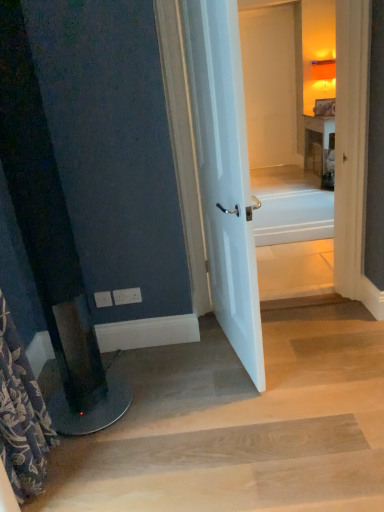
This screenshot has height=512, width=384. In order to click on white plastic electric outlet at lower left, the second electric outlet in the right-to-left sequence in this screenshot , I will do `click(103, 298)`.

Measure the distance between light brown wood at lower center and camera.

The depth of light brown wood at lower center is 1.38 meters.

The height and width of the screenshot is (512, 384). What do you see at coordinates (224, 173) in the screenshot?
I see `white glossy door at center` at bounding box center [224, 173].

This screenshot has width=384, height=512. Describe the element at coordinates (127, 296) in the screenshot. I see `white plastic electric outlet at lower left, acting as the first electric outlet starting from the right` at that location.

Find the location of `white plastic electric outlet at lower left, placed as the first electric outlet when sorted from left to right`. white plastic electric outlet at lower left, placed as the first electric outlet when sorted from left to right is located at coordinates (103, 298).

From the picture: Does floral fabric shower curtain at left have a lesser height compared to white glossy door at center?

Yes.

Would you say floral fabric shower curtain at left is inside or outside white glossy door at center?

floral fabric shower curtain at left is not inside white glossy door at center, it's outside.

What are the coordinates of `shower curtain below the white glossy door at center (from the image's perspective)` in the screenshot? It's located at (21, 415).

Which of these two, white plastic electric outlet at lower left, the second electric outlet in the right-to-left sequence, or white plastic electric outlet at lower left, which ranks as the 2th electric outlet in left-to-right order, is smaller?

white plastic electric outlet at lower left, the second electric outlet in the right-to-left sequence, is smaller.

Is white plastic electric outlet at lower left, placed as the first electric outlet when sorted from left to right, inside or outside of white plastic electric outlet at lower left, acting as the first electric outlet starting from the right?

white plastic electric outlet at lower left, placed as the first electric outlet when sorted from left to right, exists outside the volume of white plastic electric outlet at lower left, acting as the first electric outlet starting from the right.

Is point (103, 294) farther from viewer compared to point (131, 296)?

Yes, point (103, 294) is farther from viewer.

From the image's perspective, which is below, white glossy door at center or white plastic electric outlet at lower left, the second electric outlet in the right-to-left sequence?

white plastic electric outlet at lower left, the second electric outlet in the right-to-left sequence, from the image's perspective.

Can you confirm if white glossy door at center is wider than white plastic electric outlet at lower left, placed as the first electric outlet when sorted from left to right?

Yes, white glossy door at center is wider than white plastic electric outlet at lower left, placed as the first electric outlet when sorted from left to right.

Considering the positions of objects white glossy door at center and white plastic electric outlet at lower left, placed as the first electric outlet when sorted from left to right, in the image provided, who is behind, white glossy door at center or white plastic electric outlet at lower left, placed as the first electric outlet when sorted from left to right,?

Positioned behind is white plastic electric outlet at lower left, placed as the first electric outlet when sorted from left to right.

From a real-world perspective, which is physically below, floral fabric shower curtain at left or white plastic electric outlet at lower left, which ranks as the 2th electric outlet in left-to-right order?

white plastic electric outlet at lower left, which ranks as the 2th electric outlet in left-to-right order, from a real-world perspective.

Is floral fabric shower curtain at left far away from white plastic electric outlet at lower left, which ranks as the 2th electric outlet in left-to-right order?

floral fabric shower curtain at left is actually quite close to white plastic electric outlet at lower left, which ranks as the 2th electric outlet in left-to-right order.

Between floral fabric shower curtain at left and white plastic electric outlet at lower left, acting as the first electric outlet starting from the right, which one has smaller size?

Smaller between the two is white plastic electric outlet at lower left, acting as the first electric outlet starting from the right.

Which of these two, floral fabric shower curtain at left or white plastic electric outlet at lower left, which ranks as the 2th electric outlet in left-to-right order, stands taller?

floral fabric shower curtain at left.

Does white glossy bathtub at center turn towards white plastic electric outlet at lower left, acting as the first electric outlet starting from the right?

No, white glossy bathtub at center does not turn towards white plastic electric outlet at lower left, acting as the first electric outlet starting from the right.

In terms of size, does white glossy bathtub at center appear bigger or smaller than white plastic electric outlet at lower left, which ranks as the 2th electric outlet in left-to-right order?

Considering their sizes, white glossy bathtub at center takes up more space than white plastic electric outlet at lower left, which ranks as the 2th electric outlet in left-to-right order.

Relative to white plastic electric outlet at lower left, which ranks as the 2th electric outlet in left-to-right order, is white glossy bathtub at center in front or behind?

Visually, white glossy bathtub at center is located behind white plastic electric outlet at lower left, which ranks as the 2th electric outlet in left-to-right order.

Looking at their sizes, would you say white glossy bathtub at center is wider or thinner than white plastic electric outlet at lower left, acting as the first electric outlet starting from the right?

Considering their sizes, white glossy bathtub at center looks broader than white plastic electric outlet at lower left, acting as the first electric outlet starting from the right.

What's the angular difference between white glossy bathtub at center and floral fabric shower curtain at left's facing directions?

The angle between the facing direction of white glossy bathtub at center and the facing direction of floral fabric shower curtain at left is 90.2 degrees.

From a real-world perspective, is white glossy bathtub at center over floral fabric shower curtain at left?

No, from a real-world perspective, white glossy bathtub at center is not over floral fabric shower curtain at left

Which of these two, white glossy bathtub at center or floral fabric shower curtain at left, is bigger?

floral fabric shower curtain at left is bigger.

Which of these two, white glossy bathtub at center or floral fabric shower curtain at left, is thinner?

floral fabric shower curtain at left.

From the image's perspective, between light brown wood at lower center and white plastic electric outlet at lower left, the second electric outlet in the right-to-left sequence, who is located below?

light brown wood at lower center is shown below in the image.

Is point (136, 354) closer or farther from the camera than point (111, 305)?

Point (136, 354).

Where is `door above the floral fabric shower curtain at left (from the image's perspective)`? This screenshot has height=512, width=384. door above the floral fabric shower curtain at left (from the image's perspective) is located at coordinates (224, 173).

The width and height of the screenshot is (384, 512). Identify the location of electric outlet on the left of white plastic electric outlet at lower left, which ranks as the 2th electric outlet in left-to-right order. (103, 298).

Which object lies further to the anchor point white glossy bathtub at center, light brown wood at lower center or floral fabric shower curtain at left?

floral fabric shower curtain at left is further to white glossy bathtub at center.

Based on their spatial positions, is white glossy bathtub at center or light brown wood at lower center closer to white glossy door at center?

Among the two, light brown wood at lower center is located nearer to white glossy door at center.

Looking at the image, which one is located further to white plastic electric outlet at lower left, placed as the first electric outlet when sorted from left to right, white plastic electric outlet at lower left, acting as the first electric outlet starting from the right, or white glossy door at center?

white glossy door at center lies further to white plastic electric outlet at lower left, placed as the first electric outlet when sorted from left to right, than the other object.

Considering their positions, is white plastic electric outlet at lower left, acting as the first electric outlet starting from the right, positioned closer to white plastic electric outlet at lower left, the second electric outlet in the right-to-left sequence, than floral fabric shower curtain at left?

white plastic electric outlet at lower left, acting as the first electric outlet starting from the right, is closer to white plastic electric outlet at lower left, the second electric outlet in the right-to-left sequence.

Which object lies further to the anchor point white glossy door at center, white plastic electric outlet at lower left, which ranks as the 2th electric outlet in left-to-right order, or light brown wood at lower center?

white plastic electric outlet at lower left, which ranks as the 2th electric outlet in left-to-right order, is positioned further to the anchor white glossy door at center.

From the image, which object appears to be farther from white plastic electric outlet at lower left, acting as the first electric outlet starting from the right, light brown wood at lower center or white glossy door at center?

light brown wood at lower center.

When comparing their distances from light brown wood at lower center, does white plastic electric outlet at lower left, the second electric outlet in the right-to-left sequence, or white plastic electric outlet at lower left, acting as the first electric outlet starting from the right, seem further?

Based on the image, white plastic electric outlet at lower left, the second electric outlet in the right-to-left sequence, appears to be further to light brown wood at lower center.

Based on their spatial positions, is floral fabric shower curtain at left or white glossy bathtub at center closer to white glossy door at center?

floral fabric shower curtain at left is closer to white glossy door at center.

Identify the location of stairwell between white glossy door at center and white plastic electric outlet at lower left, which ranks as the 2th electric outlet in left-to-right order, along the z-axis. (241, 424).

In order to click on electric outlet situated between white plastic electric outlet at lower left, the second electric outlet in the right-to-left sequence, and white glossy bathtub at center from left to right in this screenshot , I will do `click(127, 296)`.

Where is `door between floral fabric shower curtain at left and light brown wood at lower center from left to right`? door between floral fabric shower curtain at left and light brown wood at lower center from left to right is located at coordinates (224, 173).

Where is `stairwell located between floral fabric shower curtain at left and white glossy bathtub at center in the depth direction`? stairwell located between floral fabric shower curtain at left and white glossy bathtub at center in the depth direction is located at coordinates (241, 424).